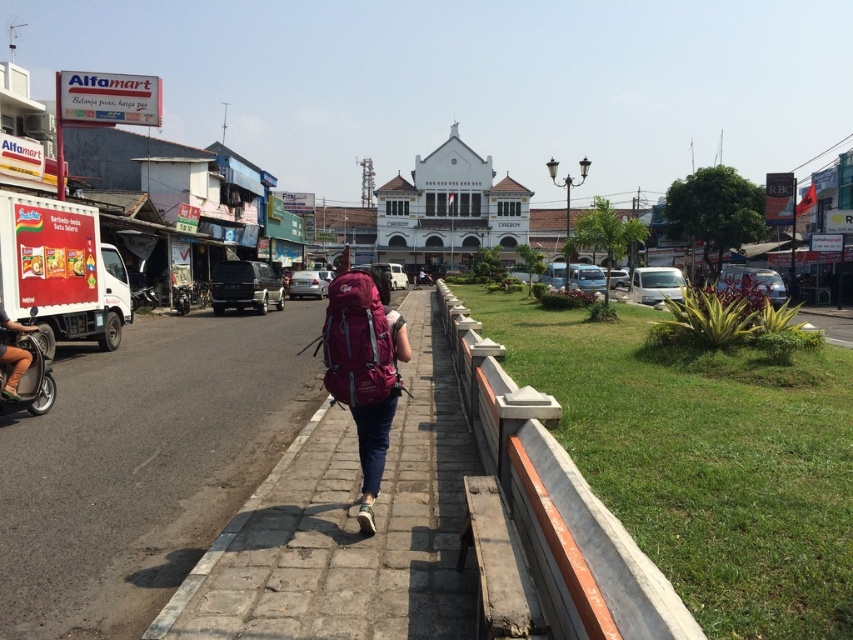
Question: Which object appears closest to the camera in this image?

Choices:
 (A) purple fabric backpack at center
 (B) matte pink backpack at center
 (C) denim shorts at left
 (D) metallic silver scooter at left

Answer: (A)

Question: Can you confirm if purple fabric backpack at center is positioned below denim shorts at left?

Choices:
 (A) yes
 (B) no

Answer: (B)

Question: Among these objects, which one is nearest to the camera?

Choices:
 (A) concrete at center
 (B) denim shorts at left
 (C) matte pink backpack at center

Answer: (A)

Question: Does matte pink backpack at center appear over metallic silver scooter at left?

Choices:
 (A) yes
 (B) no

Answer: (A)

Question: In this image, where is purple fabric backpack at center located relative to denim shorts at left?

Choices:
 (A) above
 (B) below

Answer: (A)

Question: Which point is closer to the camera?

Choices:
 (A) purple fabric backpack at center
 (B) concrete at center

Answer: (B)